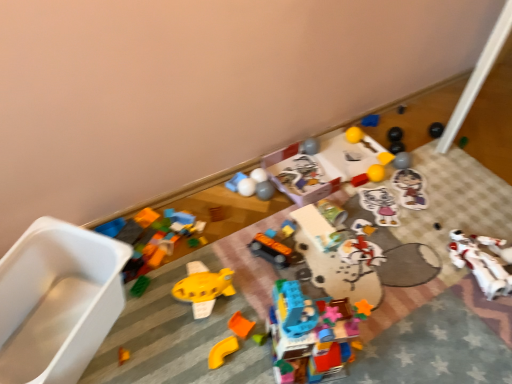
Find the location of a particular element. This screenshot has height=384, width=512. free space to the back side of white matte ball at center, arranged as the 6th toy when viewed from the left is located at coordinates (261, 166).